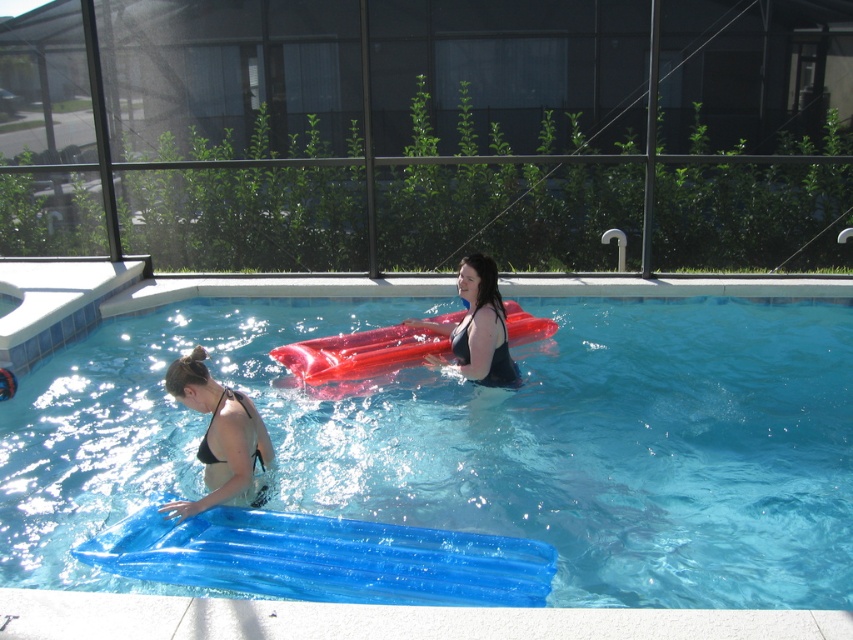
Is transparent blue float at center to the right of black matte bikini at lower left from the viewer's perspective?

Yes, transparent blue float at center is to the right of black matte bikini at lower left.

Between point (373, 316) and point (236, 456), which one is positioned behind?

The point (373, 316) is more distant.

The width and height of the screenshot is (853, 640). Describe the element at coordinates (480, 444) in the screenshot. I see `transparent blue float at center` at that location.

Where is `transparent blue float at center`? The image size is (853, 640). transparent blue float at center is located at coordinates (480, 444).

Looking at this image, is rubberized red raft at center closer to the viewer compared to matte black swimsuit at center?

That is False.

Does point (381, 360) come farther from viewer compared to point (477, 291)?

That is True.

Does point (425, 346) lie behind point (463, 289)?

Yes, it is behind point (463, 289).

Identify the location of rubberized red raft at center. (357, 358).

Which is below, black matte bikini at lower left or matte black swimsuit at center?

black matte bikini at lower left is lower down.

Between black matte bikini at lower left and matte black swimsuit at center, which one appears on the left side from the viewer's perspective?

Positioned to the left is black matte bikini at lower left.

What do you see at coordinates (218, 435) in the screenshot? This screenshot has height=640, width=853. I see `black matte bikini at lower left` at bounding box center [218, 435].

Identify the location of black matte bikini at lower left. (218, 435).